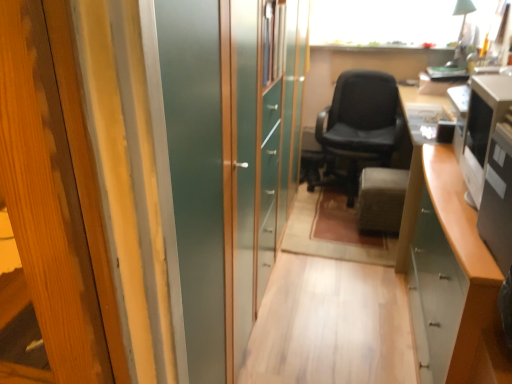
Question: Is there a large distance between black leather chair at center and black glossy desktop computer at right, which is the 1th desktop computer in front-to-back order?

Choices:
 (A) yes
 (B) no

Answer: (A)

Question: From a real-world perspective, does black leather chair at center sit lower than black glossy desktop computer at right, which is the 1th desktop computer in front-to-back order?

Choices:
 (A) no
 (B) yes

Answer: (B)

Question: Is black leather chair at center located outside black glossy desktop computer at right, which is counted as the 2th desktop computer, starting from the back?

Choices:
 (A) yes
 (B) no

Answer: (A)

Question: Is black leather chair at center closer to camera compared to black glossy desktop computer at right, which is the 1th desktop computer in front-to-back order?

Choices:
 (A) no
 (B) yes

Answer: (A)

Question: Can you confirm if black leather chair at center is bigger than black glossy desktop computer at right, which is counted as the 2th desktop computer, starting from the back?

Choices:
 (A) yes
 (B) no

Answer: (A)

Question: Is the surface of black leather chair at center in direct contact with black glossy desktop computer at right, which is counted as the 2th desktop computer, starting from the back?

Choices:
 (A) yes
 (B) no

Answer: (B)

Question: Is black leather chair at center positioned in front of velvet gray ottoman at center?

Choices:
 (A) no
 (B) yes

Answer: (A)

Question: From a real-world perspective, is black leather chair at center over velvet gray ottoman at center?

Choices:
 (A) yes
 (B) no

Answer: (A)

Question: Can you confirm if black leather chair at center is shorter than velvet gray ottoman at center?

Choices:
 (A) no
 (B) yes

Answer: (A)

Question: Is black leather chair at center smaller than velvet gray ottoman at center?

Choices:
 (A) yes
 (B) no

Answer: (B)

Question: Considering the relative positions of black leather chair at center and velvet gray ottoman at center in the image provided, is black leather chair at center to the right of velvet gray ottoman at center from the viewer's perspective?

Choices:
 (A) yes
 (B) no

Answer: (B)

Question: From a real-world perspective, is black leather chair at center beneath velvet gray ottoman at center?

Choices:
 (A) yes
 (B) no

Answer: (B)

Question: Does satin silver monitor at right, positioned as the 1th desktop computer in back-to-front order, have a lesser width compared to black leather chair at center?

Choices:
 (A) yes
 (B) no

Answer: (A)